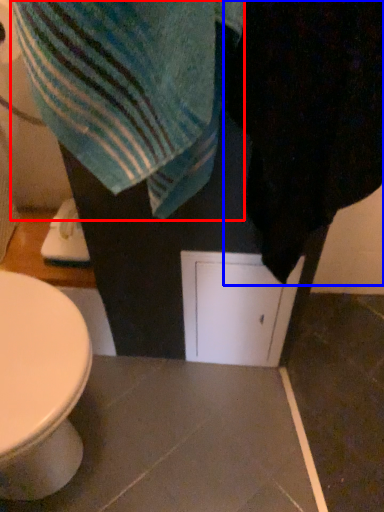
Question: Which object is further to the camera taking this photo, beach towel (highlighted by a red box) or bath towel (highlighted by a blue box)?

Choices:
 (A) beach towel
 (B) bath towel

Answer: (A)